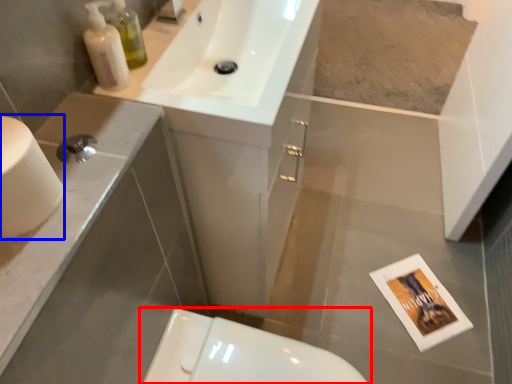
Question: Which point is closer to the camera, toilet (highlighted by a red box) or toilet paper (highlighted by a blue box)?

Choices:
 (A) toilet
 (B) toilet paper

Answer: (B)